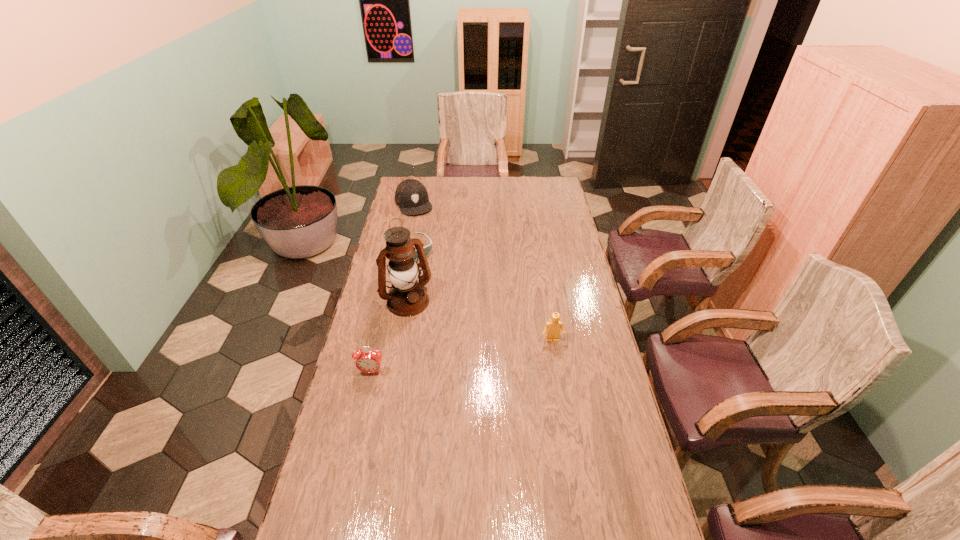
Identify the location of alarm clock that is at the left edge. The height and width of the screenshot is (540, 960). (366, 361).

Identify the location of lantern present at the left edge. (407, 297).

The width and height of the screenshot is (960, 540). I want to click on goggles located at the left edge, so click(427, 249).

Locate an element on the screen. The image size is (960, 540). cap positioned at the left edge is located at coordinates (411, 196).

Image resolution: width=960 pixels, height=540 pixels. I want to click on object at the right edge, so click(554, 326).

You are a GUI agent. You are given a task and a screenshot of the screen. Output one action in this format:
    pyautogui.click(x=<x>, y=<y>)
    Task: Click on the object that is positioned at the far left corner
    
    Given the screenshot: What is the action you would take?
    pyautogui.click(x=411, y=196)

The height and width of the screenshot is (540, 960). In order to click on vacant region at the far edge of the desktop in this screenshot , I will do `click(516, 192)`.

Find the location of a particular element. vacant space at the near edge of the desktop is located at coordinates (532, 536).

Where is `free spot at the left edge of the desktop`? free spot at the left edge of the desktop is located at coordinates (386, 259).

The height and width of the screenshot is (540, 960). I want to click on vacant space at the right edge of the desktop, so click(570, 278).